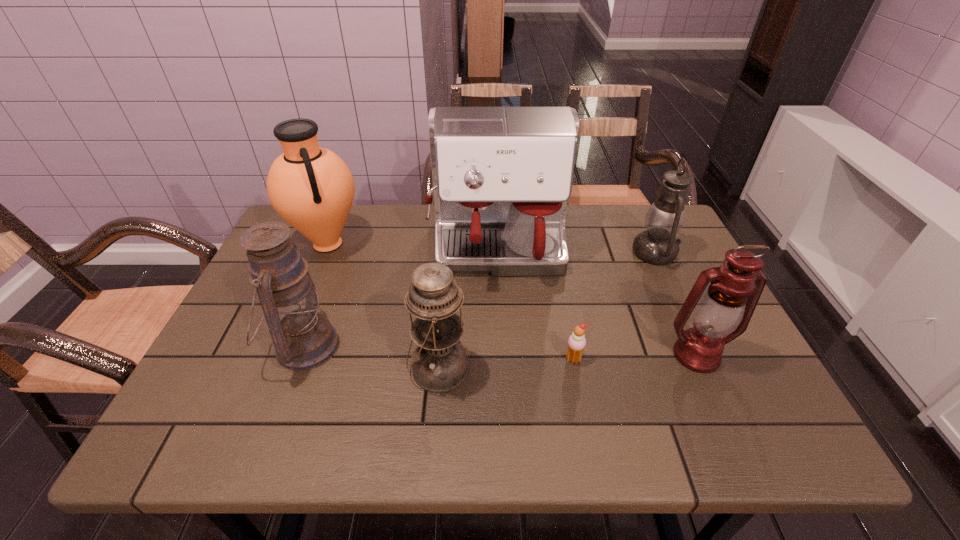
Locate an element on the screen. This screenshot has height=540, width=960. coffee maker is located at coordinates (502, 177).

Where is `pitcher`? pitcher is located at coordinates 310,187.

Where is `the leftmost oil lamp`? the leftmost oil lamp is located at coordinates (303, 339).

Identify the location of the farthest oil lamp. The image size is (960, 540). (657, 245).

You are a GUI agent. You are given a task and a screenshot of the screen. Output one action in this format:
    pyautogui.click(x=<x>, y=<y>)
    Task: Click on the second oil lamp from left to right
    The height and width of the screenshot is (540, 960).
    Given the screenshot: What is the action you would take?
    pyautogui.click(x=440, y=364)

Where is `icecream`? This screenshot has height=540, width=960. icecream is located at coordinates (576, 343).

The height and width of the screenshot is (540, 960). I want to click on free region located on the front of the coffee maker near the spout, so (501, 328).

Find the location of a particular element. vacant space located 0.070m on the front of the pitcher is located at coordinates (309, 288).

What are the coordinates of `free space located on the left of the leftmost oil lamp` in the screenshot? It's located at (227, 346).

The height and width of the screenshot is (540, 960). In order to click on free location located on the left of the farthest oil lamp in this screenshot , I will do point(576,253).